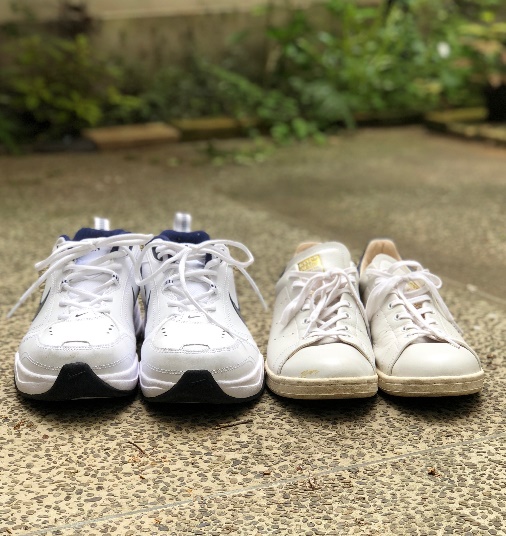
Where is `shoe`? This screenshot has width=506, height=536. shoe is located at coordinates (80, 333), (184, 334), (319, 366), (427, 366).